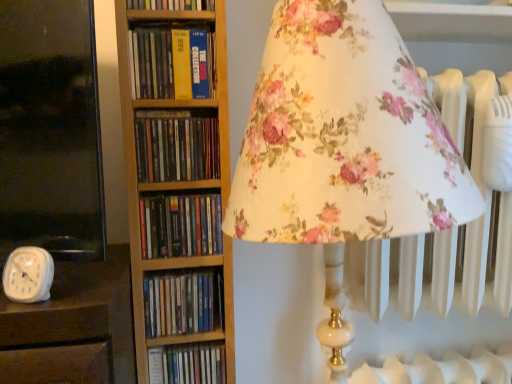
Question: Which direction should I rotate to look at hardcover book at upper center, which is the first book in top-to-bottom order?

Choices:
 (A) right
 (B) left

Answer: (B)

Question: Should I look upward or downward to see hardcover book at center, placed as the 4th book when sorted from top to bottom?

Choices:
 (A) down
 (B) up

Answer: (A)

Question: Does yellow hardcover book at center, which appears as the second book when viewed from the top, lie behind blue hardcover book at center, positioned as the 2th book in bottom-to-top order?

Choices:
 (A) yes
 (B) no

Answer: (B)

Question: Does yellow hardcover book at center, positioned as the 5th book in bottom-to-top order, have a greater height compared to blue hardcover book at center, positioned as the 2th book in bottom-to-top order?

Choices:
 (A) no
 (B) yes

Answer: (B)

Question: Is yellow hardcover book at center, which appears as the second book when viewed from the top, bigger than blue hardcover book at center, positioned as the 2th book in bottom-to-top order?

Choices:
 (A) no
 (B) yes

Answer: (B)

Question: From a real-world perspective, does yellow hardcover book at center, positioned as the 5th book in bottom-to-top order, stand above blue hardcover book at center, which ranks as the fifth book in top-to-bottom order?

Choices:
 (A) yes
 (B) no

Answer: (A)

Question: Considering the relative positions of yellow hardcover book at center, which appears as the second book when viewed from the top, and blue hardcover book at center, which ranks as the fifth book in top-to-bottom order, in the image provided, is yellow hardcover book at center, which appears as the second book when viewed from the top, in front of blue hardcover book at center, which ranks as the fifth book in top-to-bottom order,?

Choices:
 (A) yes
 (B) no

Answer: (A)

Question: Is the surface of yellow hardcover book at center, which appears as the second book when viewed from the top, in direct contact with blue hardcover book at center, positioned as the 2th book in bottom-to-top order?

Choices:
 (A) yes
 (B) no

Answer: (B)

Question: Is the position of hardcover book at center, which ranks as the third book in bottom-to-top order, more distant than that of yellow hardcover book at center, which appears as the second book when viewed from the top?

Choices:
 (A) yes
 (B) no

Answer: (A)

Question: Would you say hardcover book at center, placed as the 4th book when sorted from top to bottom, contains yellow hardcover book at center, positioned as the 5th book in bottom-to-top order?

Choices:
 (A) yes
 (B) no

Answer: (B)

Question: Is hardcover book at center, which ranks as the third book in bottom-to-top order, to the right of yellow hardcover book at center, positioned as the 5th book in bottom-to-top order, from the viewer's perspective?

Choices:
 (A) yes
 (B) no

Answer: (A)

Question: Considering the relative sizes of hardcover book at center, placed as the 4th book when sorted from top to bottom, and yellow hardcover book at center, which appears as the second book when viewed from the top, in the image provided, is hardcover book at center, placed as the 4th book when sorted from top to bottom, shorter than yellow hardcover book at center, which appears as the second book when viewed from the top,?

Choices:
 (A) yes
 (B) no

Answer: (A)

Question: Is hardcover book at center, which ranks as the third book in bottom-to-top order, at the left side of yellow hardcover book at center, which appears as the second book when viewed from the top?

Choices:
 (A) yes
 (B) no

Answer: (B)

Question: From a real-world perspective, is hardcover book at center, placed as the 4th book when sorted from top to bottom, positioned under yellow hardcover book at center, which appears as the second book when viewed from the top, based on gravity?

Choices:
 (A) yes
 (B) no

Answer: (A)

Question: From a real-world perspective, is blue hardcover book at center, which ranks as the fifth book in top-to-bottom order, located beneath hardcover book at center, which ranks as the third book in bottom-to-top order?

Choices:
 (A) no
 (B) yes

Answer: (B)